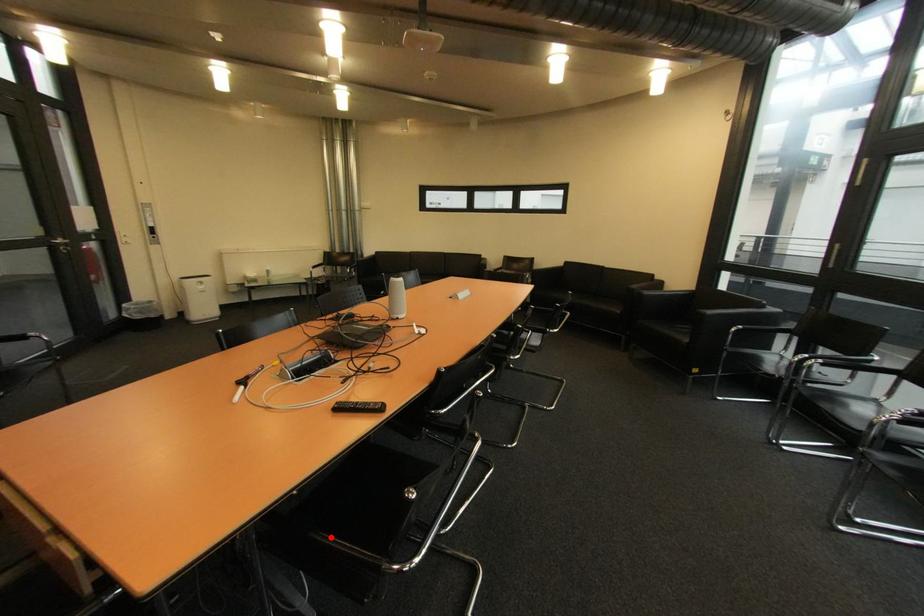
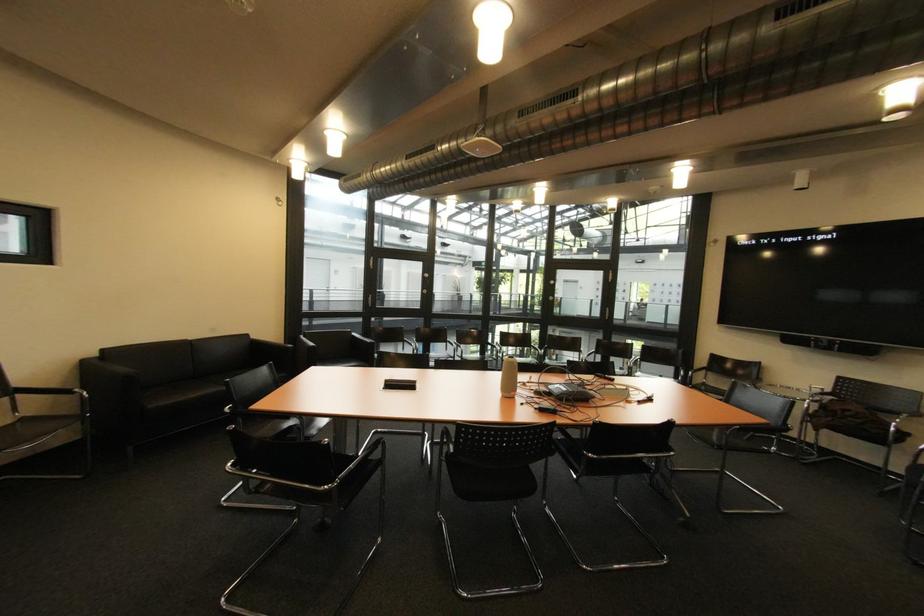
Question: I am providing you with two images of the same scene from different viewpoints. A red point is marked on the first image. At the location where the point appears in image 1, is it still visible in image 2?

Choices:
 (A) Yes
 (B) No

Answer: (B)